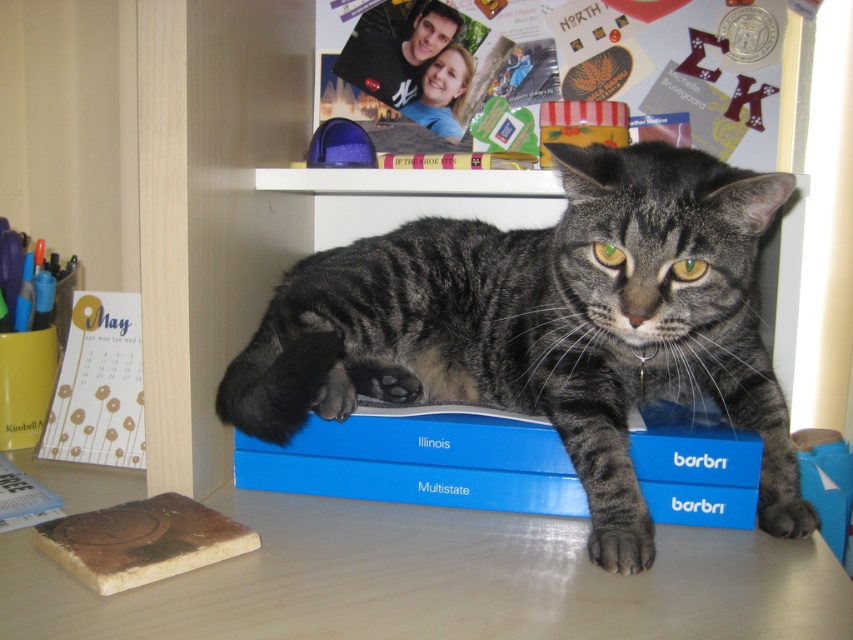
Is wooden table at lower center thinner than gold paper calendar at left?

In fact, wooden table at lower center might be wider than gold paper calendar at left.

Who is positioned more to the left, wooden table at lower center or gold paper calendar at left?

gold paper calendar at left is more to the left.

At what (x,y) coordinates should I click in order to perform the action: click on wooden table at lower center. Please return your answer as a coordinate pair (x, y). The height and width of the screenshot is (640, 853). Looking at the image, I should click on (439, 580).

Locate an element on the screen. wooden table at lower center is located at coordinates (439, 580).

Is gray tabby cat at center positioned in front of wooden table at lower center?

No, it is not.

Describe the element at coordinates (548, 326) in the screenshot. I see `gray tabby cat at center` at that location.

What are the coordinates of `gray tabby cat at center` in the screenshot? It's located at (548, 326).

Can you confirm if blue matte box at center is taller than gold paper calendar at left?

No.

Is blue matte box at center to the left of gold paper calendar at left from the viewer's perspective?

Incorrect, blue matte box at center is not on the left side of gold paper calendar at left.

Is point (337, 445) positioned behind point (80, 428)?

No.

I want to click on blue matte box at center, so click(x=421, y=461).